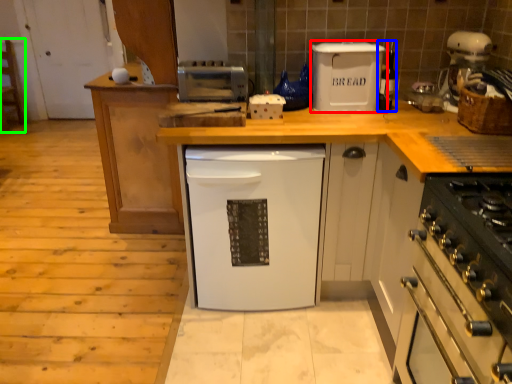
Question: Considering the real-world distances, which object is farthest from kitchen appliance (highlighted by a red box)? appliance (highlighted by a blue box) or chair (highlighted by a green box)?

Choices:
 (A) appliance
 (B) chair

Answer: (B)